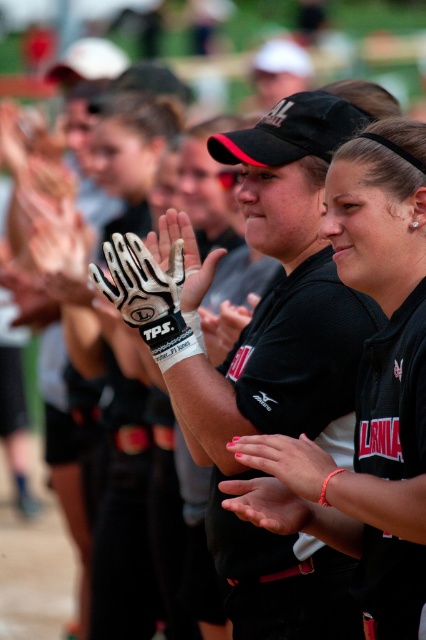
Question: Is black matte baseball glove at center further to the viewer compared to pink matte nail polish at center?

Choices:
 (A) yes
 (B) no

Answer: (A)

Question: Which object appears farthest from the camera in this image?

Choices:
 (A) smooth skin hand at center
 (B) white matte baseball glove at center
 (C) white leather glove at center

Answer: (C)

Question: Does black matte baseball glove at center have a smaller size compared to pink matte nail polish at center?

Choices:
 (A) no
 (B) yes

Answer: (A)

Question: Which point is closer to the camera?

Choices:
 (A) smooth skin hand at center
 (B) white matte baseball glove at center
 (C) pink matte nail polish at center

Answer: (C)

Question: Which of these objects is positioned closest to the white leather glove at center?

Choices:
 (A) smooth skin hand at center
 (B) white matte baseball glove at center
 (C) black matte baseball glove at center
 (D) pink matte nail polish at center

Answer: (B)

Question: Is black matte baseball glove at center to the left of smooth skin hand at center from the viewer's perspective?

Choices:
 (A) no
 (B) yes

Answer: (A)